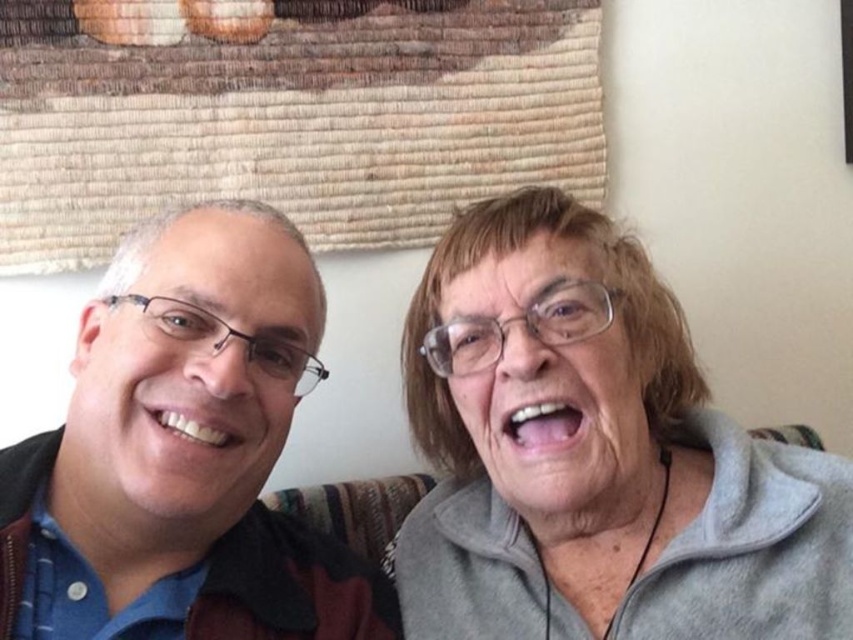
You are standing in front of the couch where the gray fleece at center and the matte black jacket at left are located. Which item is closer to you?

The gray fleece at center is closer to you because it is further to the viewer than the matte black jacket at left.

You are a photographer setting up for a portrait session. You have two items in the scene that need to be adjusted for proper framing. The gray fleece at center and the matte black jacket at left. Which item should you adjust first to ensure it doesn

The gray fleece at center is taller than the matte black jacket at left. Since it is taller, you should adjust the gray fleece at center first to ensure proper framing in the portrait session.